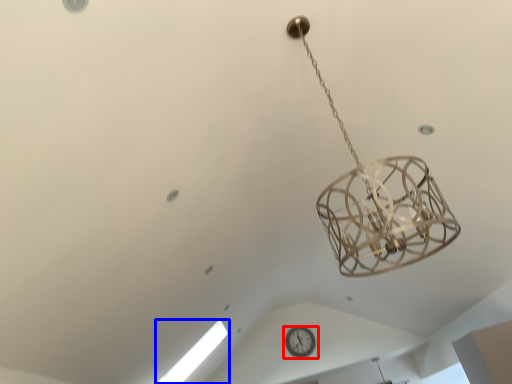
Question: Which object is closer to the camera taking this photo, wall clock (highlighted by a red box) or window (highlighted by a blue box)?

Choices:
 (A) wall clock
 (B) window

Answer: (B)